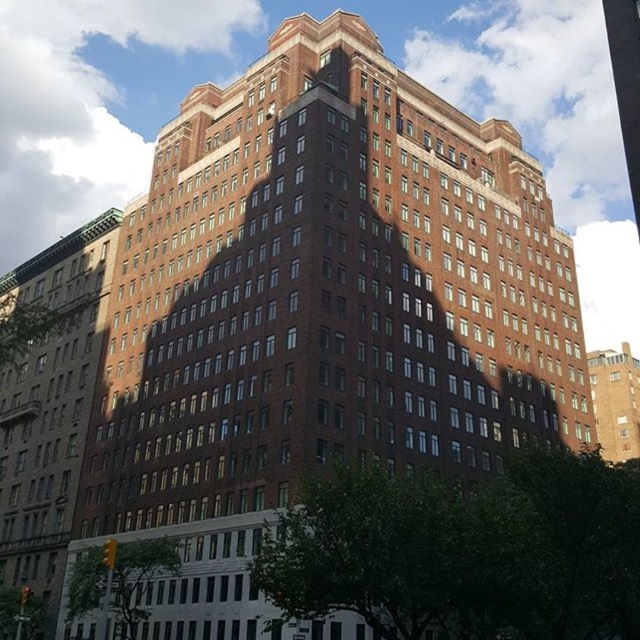
Question: Which point is farther from the camera taking this photo?

Choices:
 (A) (28, 484)
 (B) (616, 435)

Answer: (B)

Question: Does brown brick building at center appear on the left side of brown brick building at right?

Choices:
 (A) no
 (B) yes

Answer: (B)

Question: From the image, what is the correct spatial relationship of brown brick building at center in relation to brown brick building at right?

Choices:
 (A) right
 (B) left

Answer: (B)

Question: Is brown brick building at center positioned before brown brick building at right?

Choices:
 (A) yes
 (B) no

Answer: (A)